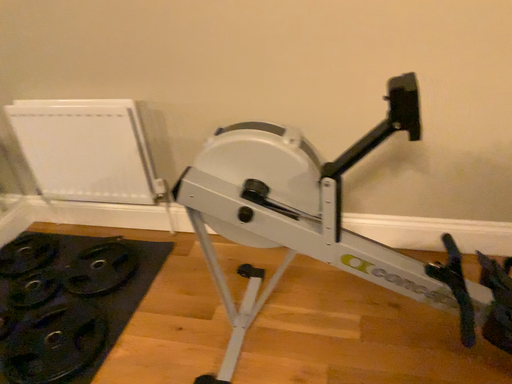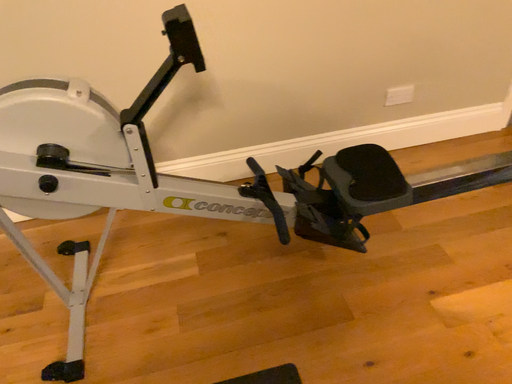
Question: How did the camera likely rotate when shooting the video?

Choices:
 (A) rotated left
 (B) rotated right

Answer: (B)